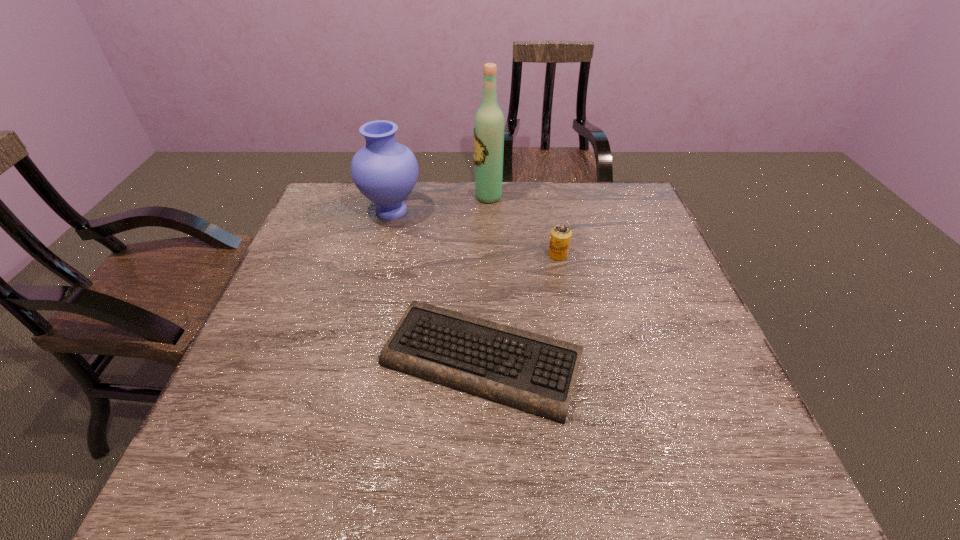
Locate an element on the screen. The height and width of the screenshot is (540, 960). vacant space situated on the right of the second nearest object is located at coordinates (601, 255).

Identify the location of free point located 0.120m on the back of the computer keyboard. (481, 275).

This screenshot has height=540, width=960. What are the coordinates of `wine bottle that is at the far edge` in the screenshot? It's located at (489, 126).

At what (x,y) coordinates should I click in order to perform the action: click on vase located in the far edge section of the desktop. Please return your answer as a coordinate pair (x, y). This screenshot has height=540, width=960. Looking at the image, I should click on (385, 171).

Where is `object that is at the left edge`? The image size is (960, 540). object that is at the left edge is located at coordinates (385, 171).

You are a GUI agent. You are given a task and a screenshot of the screen. Output one action in this format:
    pyautogui.click(x=<x>, y=<y>)
    Task: Click on the object that is at the far left corner
    The image size is (960, 540).
    Given the screenshot: What is the action you would take?
    pyautogui.click(x=385, y=171)

Locate an element on the screen. free location at the far edge is located at coordinates (432, 198).

Identify the location of vacant space at the near edge. The width and height of the screenshot is (960, 540). (475, 476).

The width and height of the screenshot is (960, 540). I want to click on vacant area at the left edge of the desktop, so coord(217,418).

Find the location of a particular element. vacant space at the right edge is located at coordinates (650, 237).